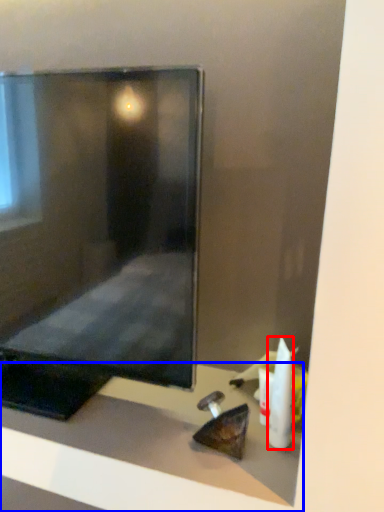
Question: Which of the following is the closest to the observer, toiletry (highlighted by a red box) or furniture (highlighted by a blue box)?

Choices:
 (A) toiletry
 (B) furniture

Answer: (B)